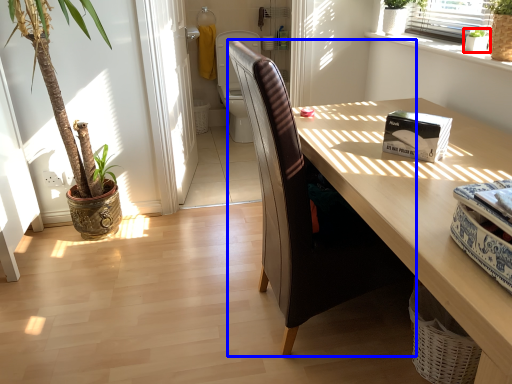
Question: Which object appears farthest to the camera in this image, houseplant (highlighted by a red box) or chair (highlighted by a blue box)?

Choices:
 (A) houseplant
 (B) chair

Answer: (A)